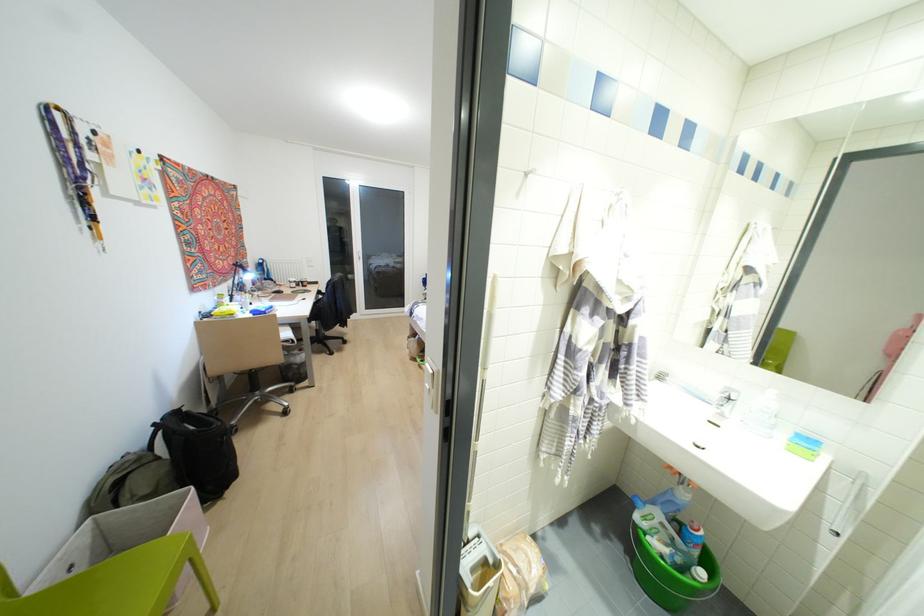
What do you see at coordinates (198, 451) in the screenshot?
I see `the black backpack` at bounding box center [198, 451].